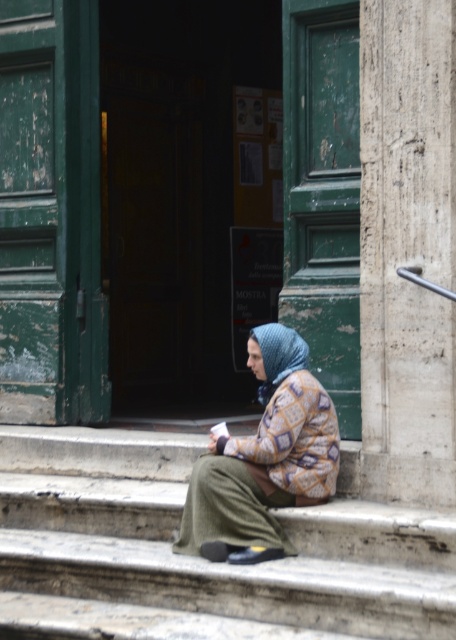
Does stone steps at center lie behind knitted woolen scarf at center?

No.

Between stone steps at center and knitted woolen scarf at center, which one is positioned higher?

knitted woolen scarf at center is higher up.

Is point (368, 611) positioned after point (298, 368)?

No, it is not.

Identify the location of stone steps at center. (197, 557).